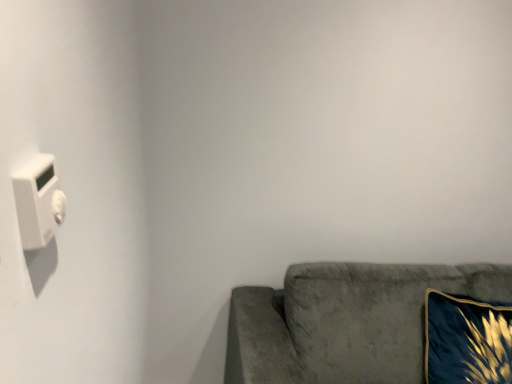
Question: Considering the relative sizes of velvet blue pillow at lower right and white plastic light switch at left in the image provided, is velvet blue pillow at lower right shorter than white plastic light switch at left?

Choices:
 (A) no
 (B) yes

Answer: (A)

Question: From the image's perspective, is velvet blue pillow at lower right located above white plastic light switch at left?

Choices:
 (A) yes
 (B) no

Answer: (B)

Question: Does velvet blue pillow at lower right come in front of white plastic light switch at left?

Choices:
 (A) yes
 (B) no

Answer: (B)

Question: Are velvet blue pillow at lower right and white plastic light switch at left far apart?

Choices:
 (A) no
 (B) yes

Answer: (B)

Question: From the image's perspective, is velvet blue pillow at lower right beneath white plastic light switch at left?

Choices:
 (A) no
 (B) yes

Answer: (B)

Question: From the image's perspective, is white plastic light switch at left located above or below velvet blue pillow at lower right?

Choices:
 (A) below
 (B) above

Answer: (B)

Question: In terms of width, does white plastic light switch at left look wider or thinner when compared to velvet blue pillow at lower right?

Choices:
 (A) wide
 (B) thin

Answer: (B)

Question: From a real-world perspective, is white plastic light switch at left positioned above or below velvet blue pillow at lower right?

Choices:
 (A) above
 (B) below

Answer: (A)

Question: Is point (37, 153) closer or farther from the camera than point (444, 337)?

Choices:
 (A) closer
 (B) farther

Answer: (A)

Question: Considering the positions of velvet blue pillow at lower right and white plastic light switch at left in the image, is velvet blue pillow at lower right bigger or smaller than white plastic light switch at left?

Choices:
 (A) big
 (B) small

Answer: (A)

Question: From a real-world perspective, is velvet blue pillow at lower right above or below white plastic light switch at left?

Choices:
 (A) below
 (B) above

Answer: (A)

Question: From the image's perspective, relative to white plastic light switch at left, is velvet blue pillow at lower right above or below?

Choices:
 (A) below
 (B) above

Answer: (A)

Question: Does point (479, 377) appear closer or farther from the camera than point (56, 221)?

Choices:
 (A) closer
 (B) farther

Answer: (B)

Question: Is velvet gray couch at lower right wider or thinner than velvet blue pillow at lower right?

Choices:
 (A) wide
 (B) thin

Answer: (A)

Question: Is velvet gray couch at lower right inside or outside of velvet blue pillow at lower right?

Choices:
 (A) outside
 (B) inside

Answer: (A)